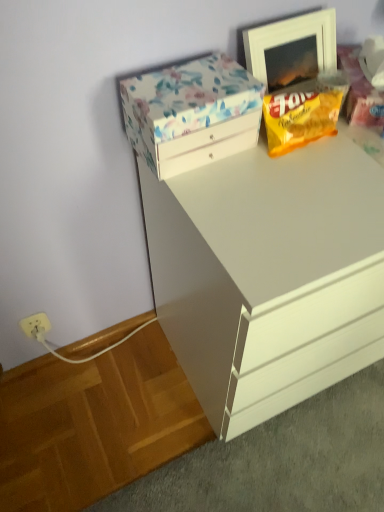
The height and width of the screenshot is (512, 384). I want to click on free spot to the right of yellow matte snack packet at upper right, so click(x=356, y=145).